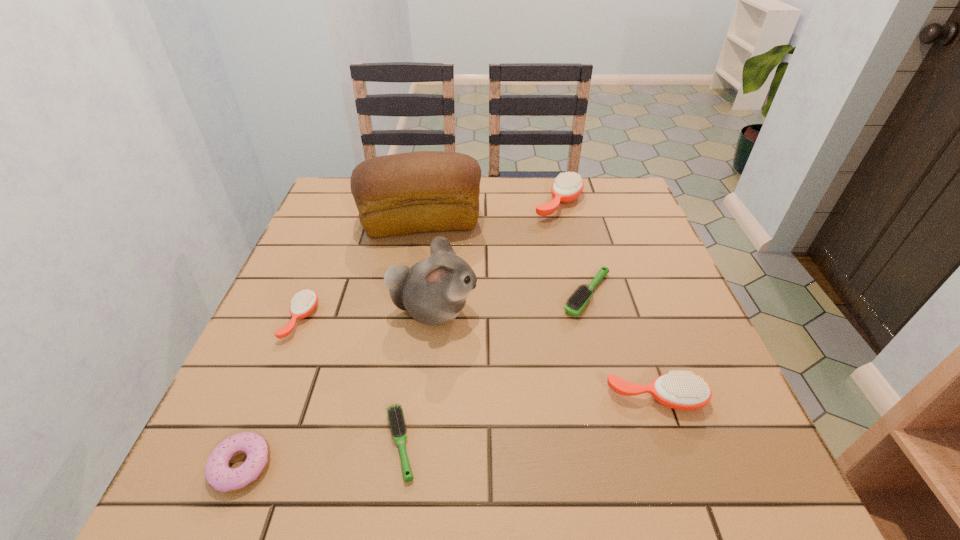
I want to click on the tallest object, so click(425, 191).

Image resolution: width=960 pixels, height=540 pixels. I want to click on brown bread, so click(x=425, y=191).

The width and height of the screenshot is (960, 540). Find the location of `the second tallest object`. the second tallest object is located at coordinates (433, 291).

Find the location of a particular element. hamster is located at coordinates (433, 291).

Identify the location of the third tallest object. This screenshot has width=960, height=540. (567, 186).

Find the location of `the tallest hairbrush`. the tallest hairbrush is located at coordinates (567, 186).

Image resolution: width=960 pixels, height=540 pixels. In order to click on the second smallest orange hairbrush in this screenshot , I will do `click(679, 390)`.

The image size is (960, 540). What are the coordinates of `the fourth tallest object` in the screenshot? It's located at tap(679, 390).

The height and width of the screenshot is (540, 960). Find the location of `the smallest orange hairbrush`. the smallest orange hairbrush is located at coordinates (303, 303).

This screenshot has height=540, width=960. What are the coordinates of `the leftmost hairbrush` in the screenshot? It's located at (303, 303).